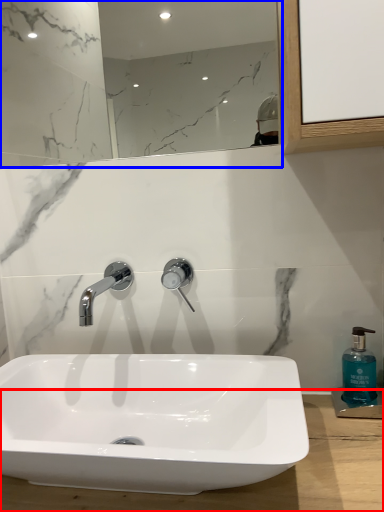
Question: Which point is further to the camera, counter top (highlighted by a red box) or mirror (highlighted by a blue box)?

Choices:
 (A) counter top
 (B) mirror

Answer: (B)